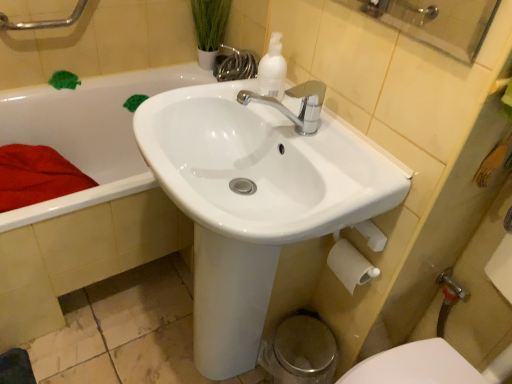
Question: Is white matte pump bottle at upper center completely or partially inside white glossy sink at center?

Choices:
 (A) yes
 (B) no

Answer: (B)

Question: Is white glossy sink at center shorter than white matte pump bottle at upper center?

Choices:
 (A) no
 (B) yes

Answer: (A)

Question: Considering the relative sizes of white glossy sink at center and white matte pump bottle at upper center in the image provided, is white glossy sink at center wider than white matte pump bottle at upper center?

Choices:
 (A) no
 (B) yes

Answer: (B)

Question: From a real-world perspective, is white glossy sink at center on top of white matte pump bottle at upper center?

Choices:
 (A) no
 (B) yes

Answer: (A)

Question: Is white glossy sink at center outside white matte pump bottle at upper center?

Choices:
 (A) no
 (B) yes

Answer: (B)

Question: Considering the relative sizes of white glossy sink at center and white matte pump bottle at upper center in the image provided, is white glossy sink at center thinner than white matte pump bottle at upper center?

Choices:
 (A) yes
 (B) no

Answer: (B)

Question: Considering the relative sizes of brushed metal grab bar at upper left and white glossy sink at center in the image provided, is brushed metal grab bar at upper left taller than white glossy sink at center?

Choices:
 (A) no
 (B) yes

Answer: (A)

Question: Is brushed metal grab bar at upper left at the right side of white glossy sink at center?

Choices:
 (A) no
 (B) yes

Answer: (A)

Question: Would you say brushed metal grab bar at upper left is a long distance from white glossy sink at center?

Choices:
 (A) yes
 (B) no

Answer: (A)

Question: From a real-world perspective, is brushed metal grab bar at upper left over white glossy sink at center?

Choices:
 (A) yes
 (B) no

Answer: (A)

Question: From the image's perspective, would you say brushed metal grab bar at upper left is shown under white glossy sink at center?

Choices:
 (A) yes
 (B) no

Answer: (B)

Question: Would you say brushed metal grab bar at upper left is outside white glossy sink at center?

Choices:
 (A) no
 (B) yes

Answer: (B)

Question: Can you confirm if brushed metal grab bar at upper left is positioned to the left of white matte toilet paper at lower right?

Choices:
 (A) no
 (B) yes

Answer: (B)